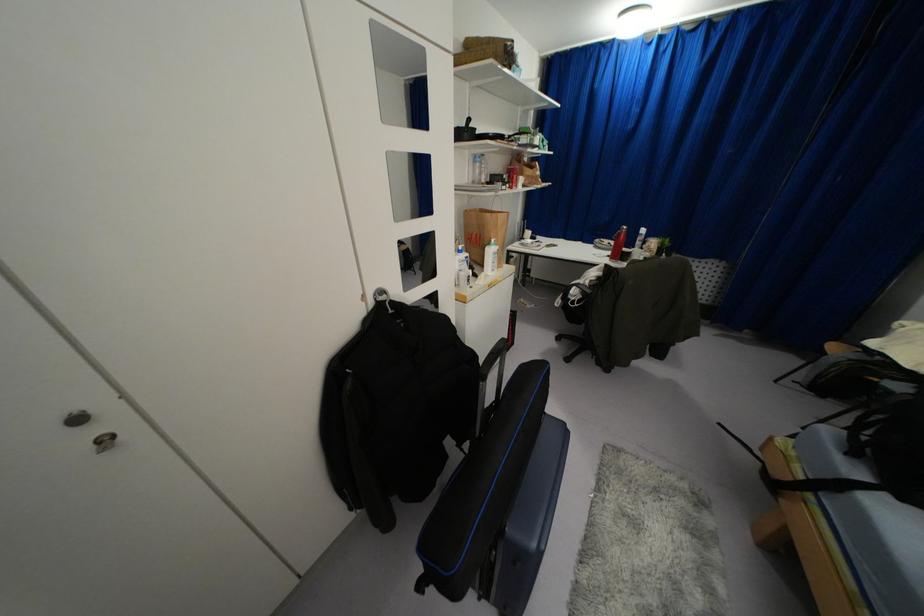
Locate an element on the screen. white bottle pump is located at coordinates (492, 256).